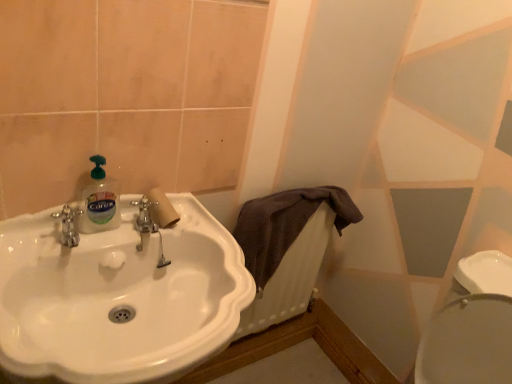
Question: Choose the correct answer: Is white glossy sink at center inside purple cotton towel at center or outside it?

Choices:
 (A) inside
 (B) outside

Answer: (B)

Question: Is white glossy sink at center taller or shorter than purple cotton towel at center?

Choices:
 (A) tall
 (B) short

Answer: (A)

Question: Considering the real-world distances, which object is farthest from the translucent plastic bottle at sink left?

Choices:
 (A) purple cotton towel at center
 (B) white glossy sink at center
 (C) brown fabric radiator at center

Answer: (C)

Question: Which is farther from the translucent plastic bottle at sink left?

Choices:
 (A) purple cotton towel at center
 (B) white glossy sink at center
 (C) brown fabric radiator at center

Answer: (C)